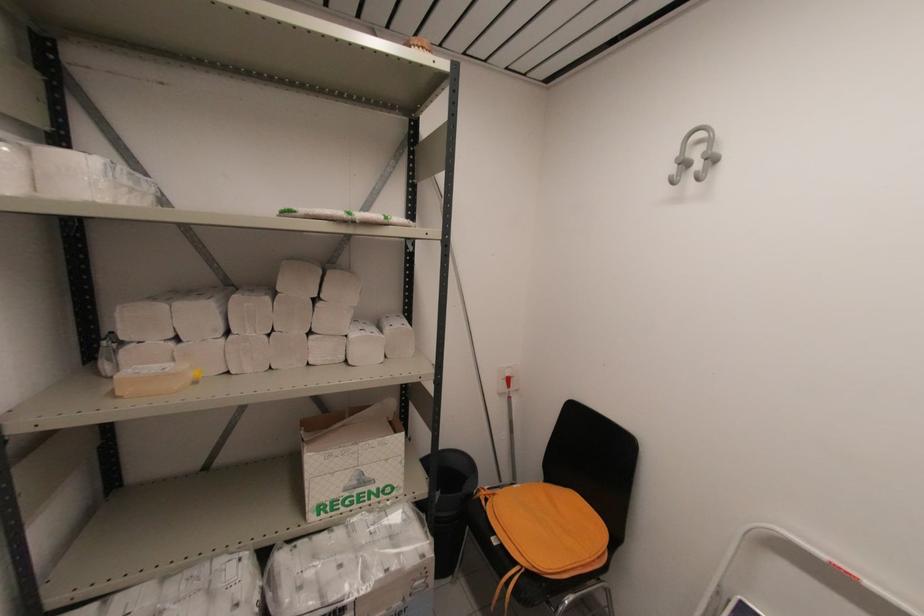
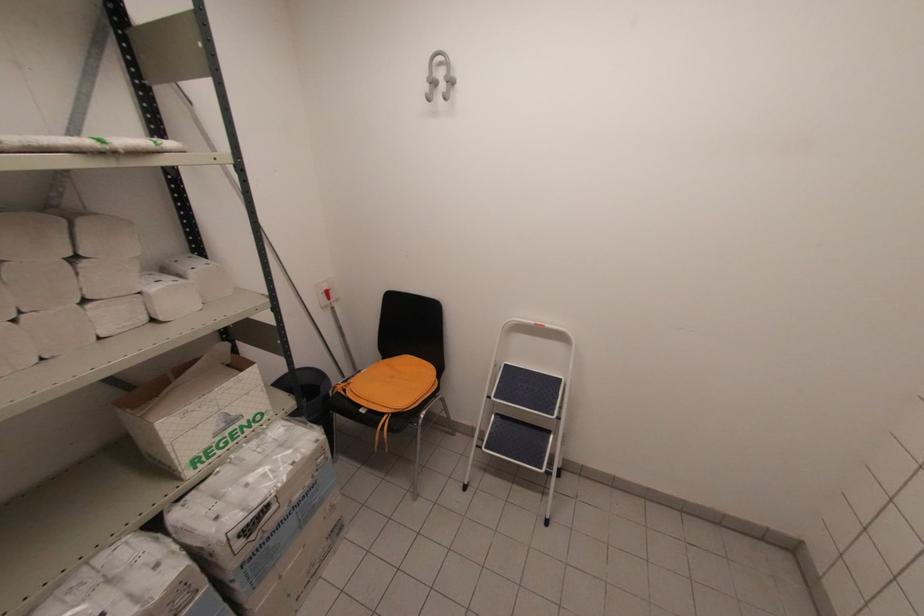
Where in the second image is the point corresponding to point 434,556 from the first image?

(325, 437)